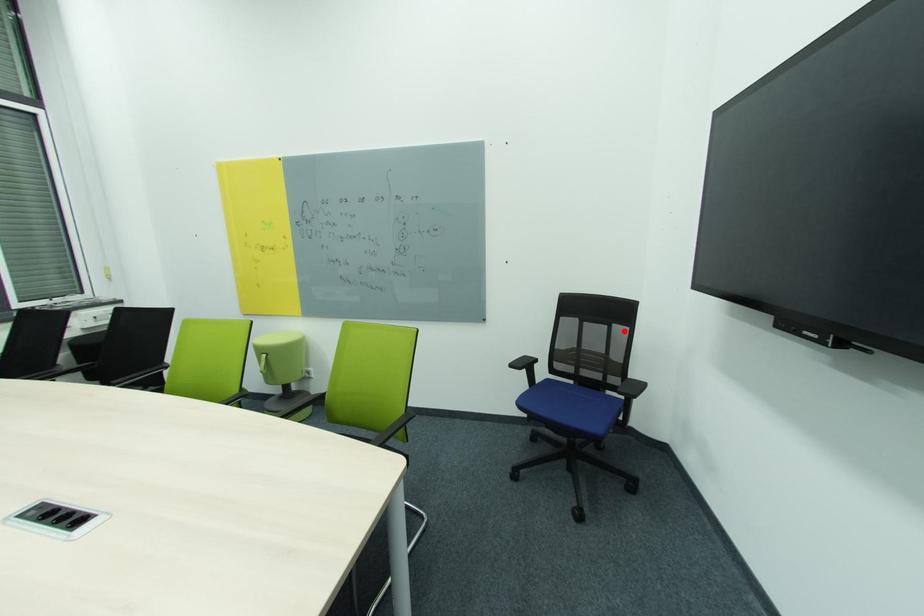
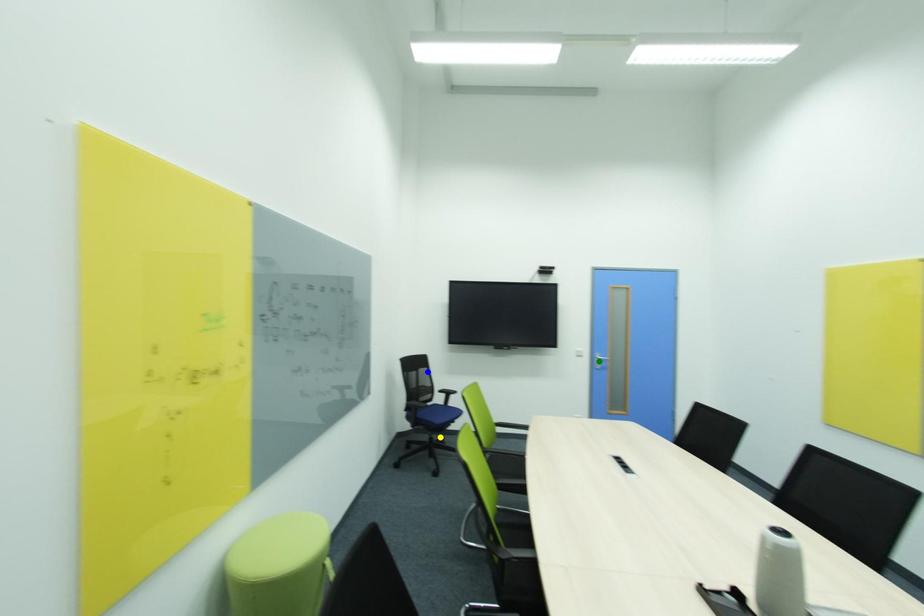
Question: I am providing you with two images of the same scene from different viewpoints. A red point is marked on the first image. You are given multiple points on the second image. In image 2, which mark is for the same physical point as the one in image 1?

Choices:
 (A) blue point
 (B) green point
 (C) yellow point

Answer: (A)